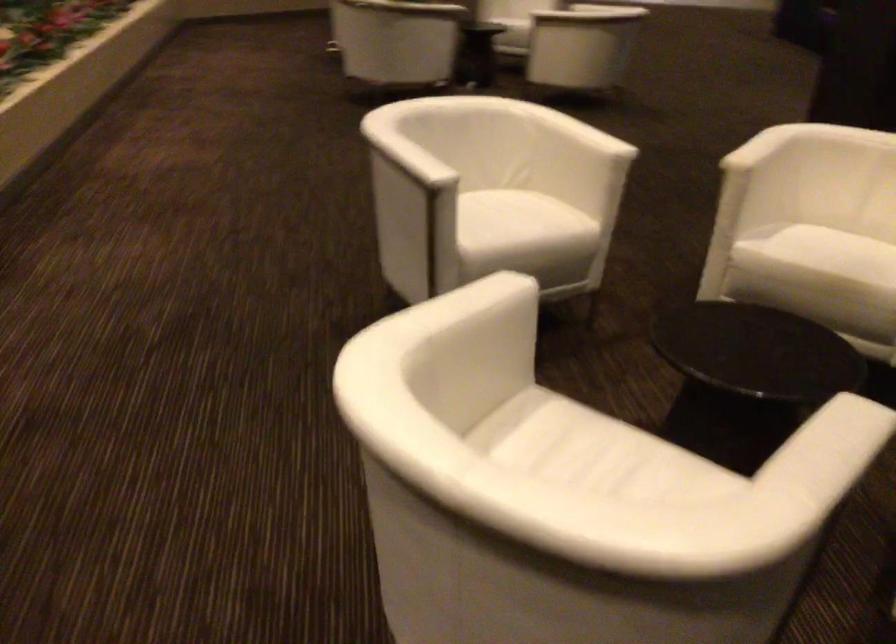
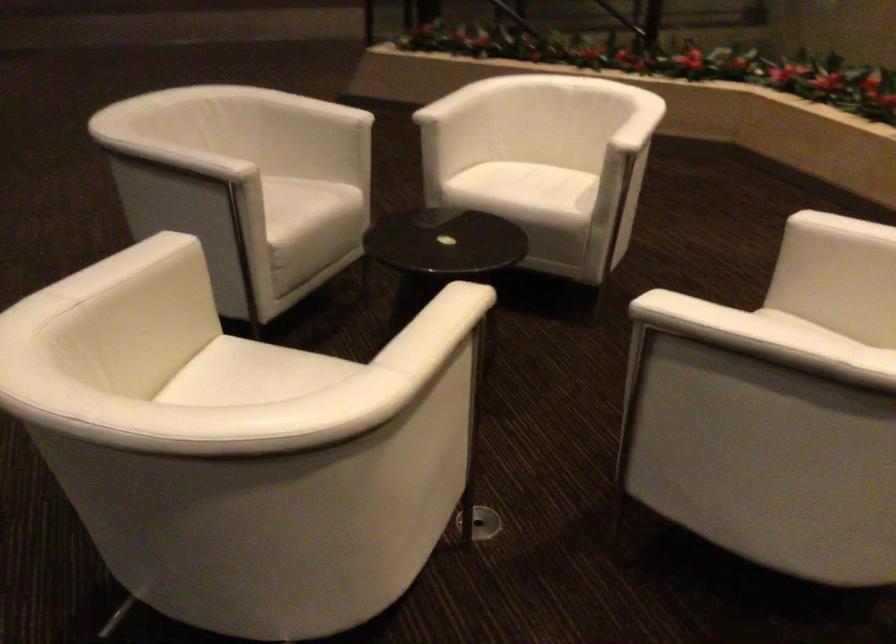
Where in the second image is the point corresponding to (608,431) from the first image?

(528, 194)